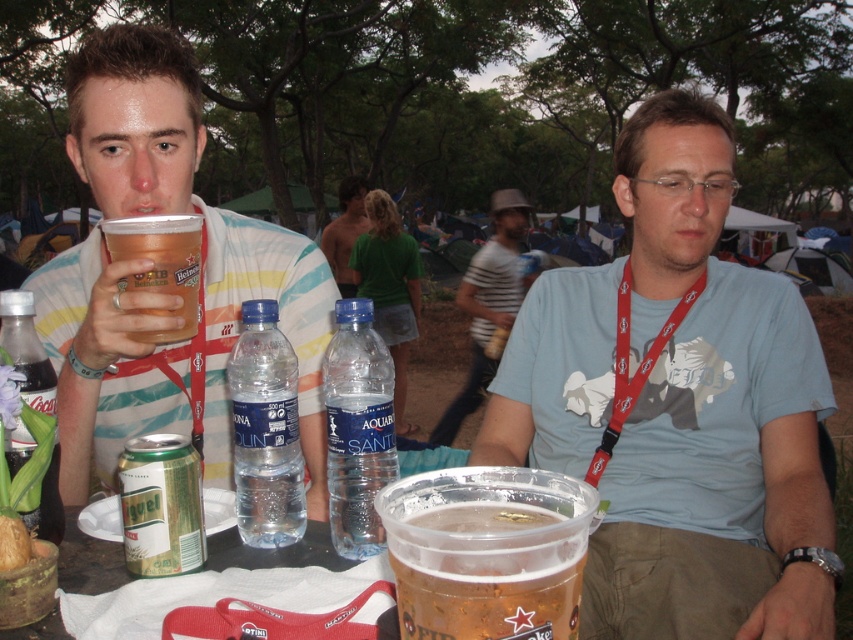
Who is positioned more to the left, shiny brown hair at center or brown textured bread at lower left?

shiny brown hair at center

Is shiny brown hair at center taller than brown textured bread at lower left?

Yes, shiny brown hair at center is taller than brown textured bread at lower left.

Image resolution: width=853 pixels, height=640 pixels. I want to click on shiny brown hair at center, so click(345, 230).

Can you confirm if green metallic can at lower left is wider than shiny brown hair at center?

No, green metallic can at lower left is not wider than shiny brown hair at center.

Who is higher up, green metallic can at lower left or shiny brown hair at center?

Positioned higher is shiny brown hair at center.

Does point (181, 525) come closer to viewer compared to point (343, 180)?

Yes, point (181, 525) is closer to viewer.

Where is `green metallic can at lower left`? The image size is (853, 640). green metallic can at lower left is located at coordinates (161, 506).

Who is positioned more to the left, light blue cotton shirt at center or brown textured bread at lower left?

brown textured bread at lower left

Is light blue cotton shirt at center to the right of brown textured bread at lower left from the viewer's perspective?

Yes, light blue cotton shirt at center is to the right of brown textured bread at lower left.

Find the location of a particular element. The image size is (853, 640). light blue cotton shirt at center is located at coordinates (677, 404).

In order to click on light blue cotton shirt at center in this screenshot , I will do `click(677, 404)`.